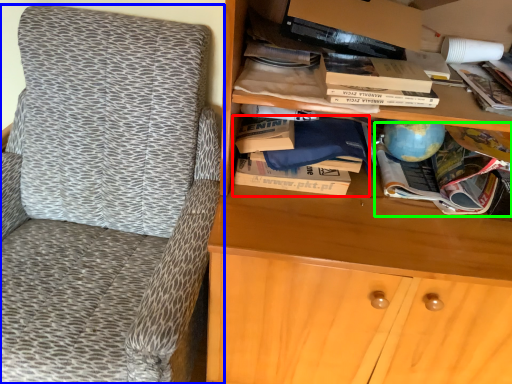
Question: Estimate the real-world distances between objects in this image. Which object is closer to book (highlighted by a red box), chair (highlighted by a blue box) or book (highlighted by a green box)?

Choices:
 (A) chair
 (B) book

Answer: (B)